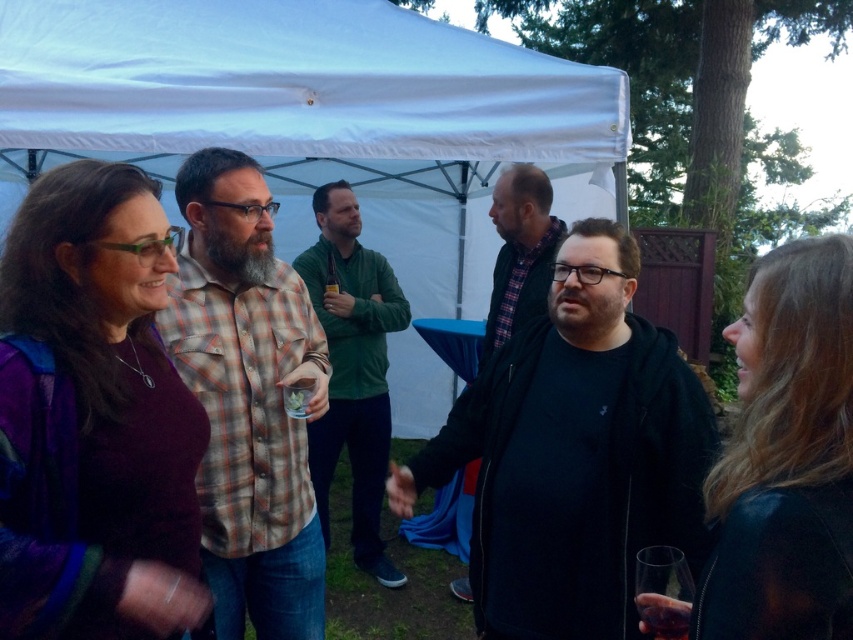
You are at the center of the image and see the black matte jacket at center and the plaid shirt at center. Which one is positioned to the right side from your viewpoint?

The black matte jacket at center is positioned to the right of the plaid shirt at center, so it is on the right side from your viewpoint.

You are organizing a clothing display and need to arrange the green matte shirt at center and the dark gray hoodie at center on a rack. Which item should be placed on the wider rack space to accommodate its size?

The green matte shirt at center should be placed on the wider rack space because its width is larger than the dark gray hoodie at center.

You are at a social gathering under a white canopy tent and see two people in the center area wearing a green matte shirt and a dark gray hoodie. From the perspective of someone standing at the front of the tent, which direction should you look to find the green matte shirt at center first before seeing the dark gray hoodie at center?

The green matte shirt at center is to the left of the dark gray hoodie at center. So, from the front of the tent, you should look to the left first to see the green matte shirt at center before the dark gray hoodie at center.